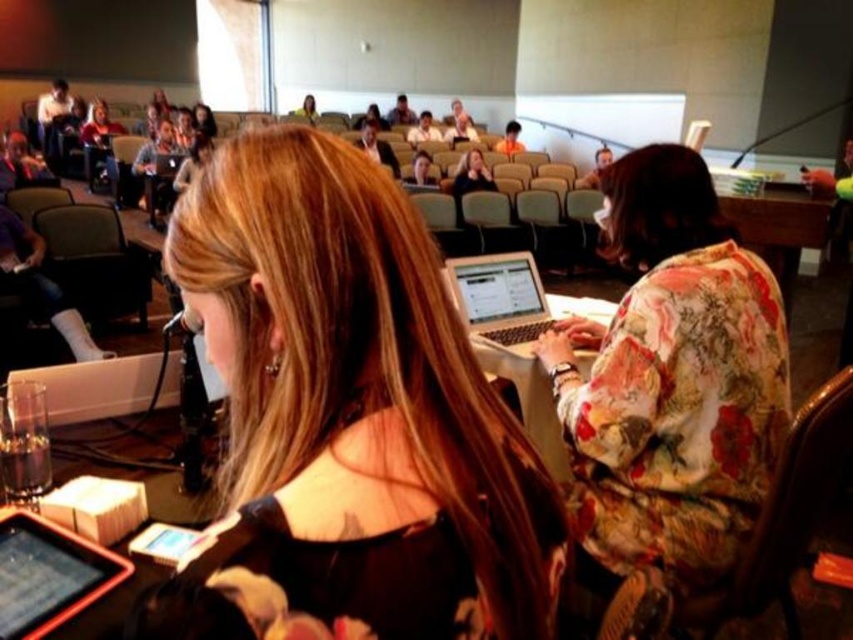
Can you confirm if wooden chair at center is taller than orange shirt at upper center?

Yes.

This screenshot has width=853, height=640. What do you see at coordinates (753, 534) in the screenshot?
I see `wooden chair at center` at bounding box center [753, 534].

This screenshot has width=853, height=640. Identify the location of wooden chair at center. (753, 534).

Is matte gray chair at left in front of orange shirt at upper center?

Yes, matte gray chair at left is closer to the viewer.

Which is below, matte gray chair at left or orange shirt at upper center?

matte gray chair at left is lower down.

Locate an element on the screen. Image resolution: width=853 pixels, height=640 pixels. matte gray chair at left is located at coordinates (94, 260).

This screenshot has width=853, height=640. I want to click on matte gray chair at left, so click(94, 260).

Where is `silver metallic laptop at center`? This screenshot has height=640, width=853. silver metallic laptop at center is located at coordinates [500, 300].

Does silver metallic laptop at center have a smaller size compared to white glossy shirt at center?

Correct, silver metallic laptop at center occupies less space than white glossy shirt at center.

Is point (529, 300) farther from camera compared to point (430, 129)?

No, (529, 300) is closer to viewer.

Image resolution: width=853 pixels, height=640 pixels. I want to click on silver metallic laptop at center, so click(x=500, y=300).